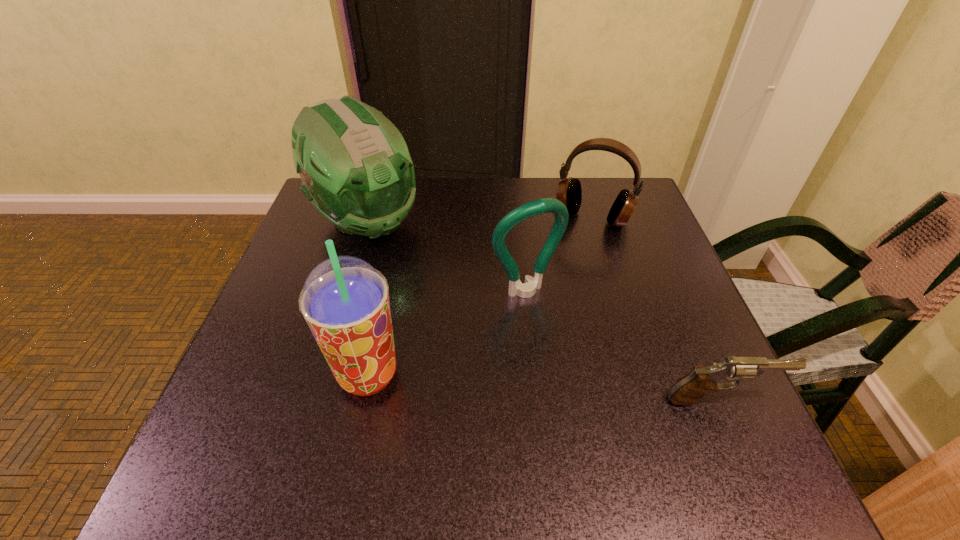
Locate an element on the screen. free space located on the ear pads of the headset is located at coordinates (554, 298).

This screenshot has width=960, height=540. In order to click on free region located 0.280m on the ear pads of the headset in this screenshot , I will do `click(548, 310)`.

I want to click on vacant space situated 0.230m on the ear pads of the headset, so click(555, 294).

This screenshot has width=960, height=540. In order to click on vacant region located at the jaws of the third object from right to left in this screenshot , I will do `click(618, 420)`.

Where is `free space located 0.260m at the jaws of the third object from right to left`? free space located 0.260m at the jaws of the third object from right to left is located at coordinates (609, 405).

Locate an element on the screen. The width and height of the screenshot is (960, 540). vacant space situated 0.140m at the jaws of the third object from right to left is located at coordinates (573, 353).

At what (x,y) coordinates should I click in order to perform the action: click on football helmet at the far edge. Please return your answer as a coordinate pair (x, y). The height and width of the screenshot is (540, 960). Looking at the image, I should click on (356, 170).

Identify the location of headset positioned at the far edge. Image resolution: width=960 pixels, height=540 pixels. (569, 192).

Find the location of a particular element. smoothie that is positioned at the near edge is located at coordinates (345, 301).

The height and width of the screenshot is (540, 960). I want to click on pistol that is at the near edge, so click(x=689, y=389).